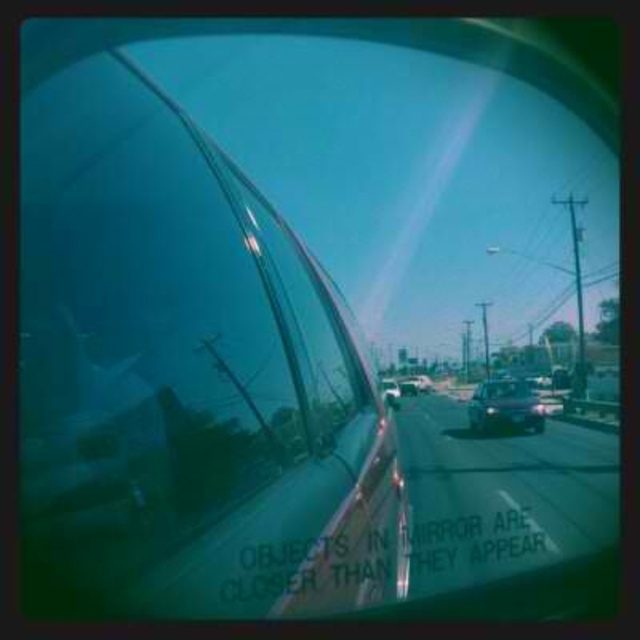
Between transparent glass car window at center and shiny metallic car at center, which one is positioned lower?

Positioned lower is shiny metallic car at center.

Which is in front, point (99, 100) or point (522, 390)?

Point (99, 100) is more forward.

Locate an element on the screen. The width and height of the screenshot is (640, 640). transparent glass car window at center is located at coordinates (186, 371).

Does point (280, 454) come farther from viewer compared to point (392, 394)?

That is False.

Which is in front, point (166, 548) or point (388, 404)?

Positioned in front is point (166, 548).

Is point (160, 397) positioned in front of point (387, 400)?

Yes, it is.

Where is `transparent glass car window at center`? The image size is (640, 640). transparent glass car window at center is located at coordinates (186, 371).

Who is lower down, shiny metallic car at center or shiny silver sedan at center?

Positioned lower is shiny metallic car at center.

Is shiny metallic car at center positioned at the back of shiny silver sedan at center?

Yes.

Which is behind, point (515, 392) or point (387, 380)?

The point (515, 392) is more distant.

The width and height of the screenshot is (640, 640). What are the coordinates of `shiny metallic car at center` in the screenshot? It's located at (504, 406).